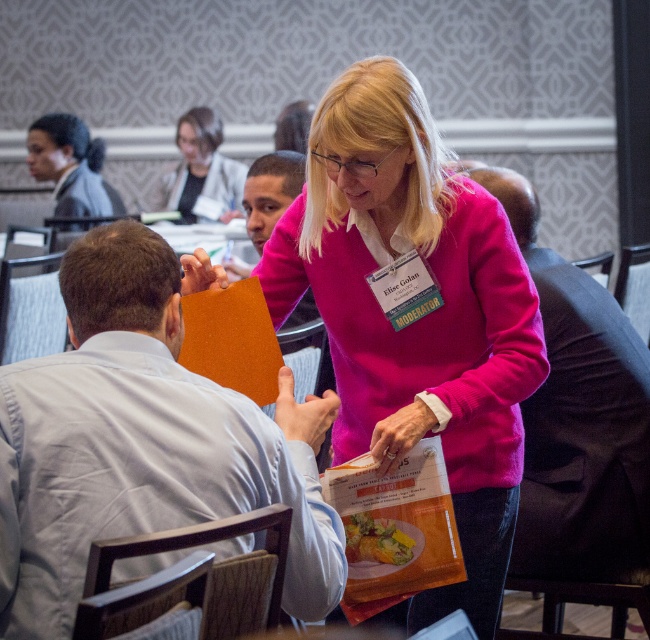
You are attending a meeting and notice two people in the front of the room. One is wearing a matte black suit at upper left and the other is wearing a matte pink sweater at upper center. Based on their positions, which one is closer to the front of the room?

The matte pink sweater at upper center is closer to the front of the room because the matte black suit at upper left is below it, indicating it is positioned further back.

You are standing in the conference room and want to place a new object at the point closest to you between point A at point A at point (83, 202) and point B at point (174, 173). Which point should you choose?

Point A at point (83, 202) is closer to the viewer, so you should choose point A at point (83, 202).

You are an event planner observing the conference room scene. You need to place a 1.2 meter tall decorative plant between the matte black suit at upper left and the matte pink sweater at upper center. Can the plant fit vertically between them?

The matte black suit at upper left is not as tall as the matte pink sweater at upper center. Since the plant is 1.2 meters tall, it can fit vertically between them as the height difference allows space.